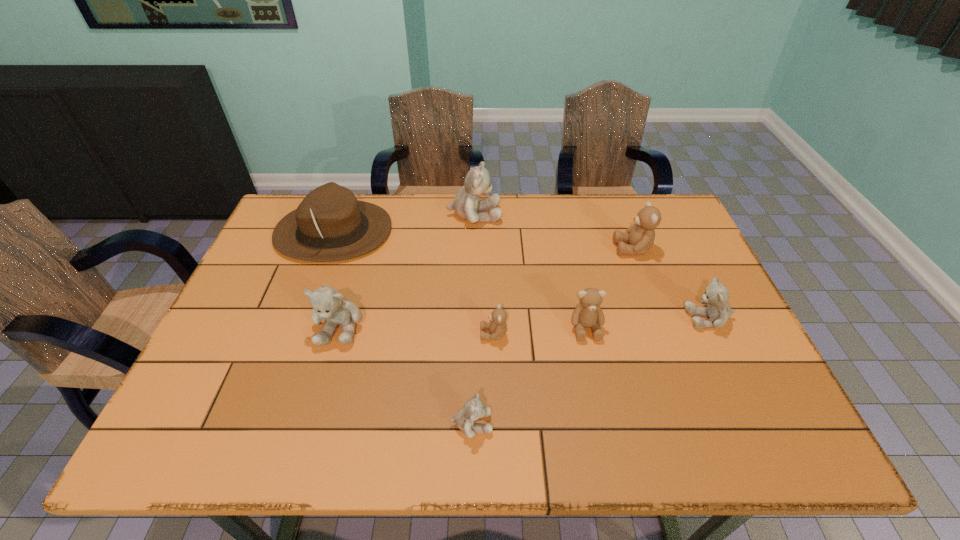
You are a GUI agent. You are given a task and a screenshot of the screen. Output one action in this format:
    pyautogui.click(x=<x>, y=<y>)
    Task: Click on the gray teddy bear that is the second closest to the second smallest brown teddy bear
    The height and width of the screenshot is (540, 960).
    Given the screenshot: What is the action you would take?
    pyautogui.click(x=473, y=409)

At what (x,y) coordinates should I click in order to perform the action: click on the closest gray teddy bear to the biggest gray teddy bear. Please return your answer as a coordinate pair (x, y). Looking at the image, I should click on (328, 304).

The width and height of the screenshot is (960, 540). In order to click on brown teddy bear that stands as the second closest to the farthest brown teddy bear in this screenshot , I will do click(x=497, y=327).

Identify which brown teddy bear is located as the nearest to the farthest brown teddy bear. Please provide its 2D coordinates. Your answer should be formatted as a tuple, i.e. [(x, y)], where the tuple contains the x and y coordinates of a point satisfying the conditions above.

[(588, 314)]

This screenshot has height=540, width=960. In order to click on free location that satisfies the following two spatial constraints: 1. on the front-facing side of the sixth nearest teddy bear; 2. on the front-facing side of the fifth teddy bear from left to right in this screenshot , I will do `click(662, 328)`.

What are the coordinates of `vacant space that satisfies the following two spatial constraints: 1. on the face of the third biggest gray teddy bear; 2. on the front-facing side of the sixth object from left to right` in the screenshot? It's located at (713, 328).